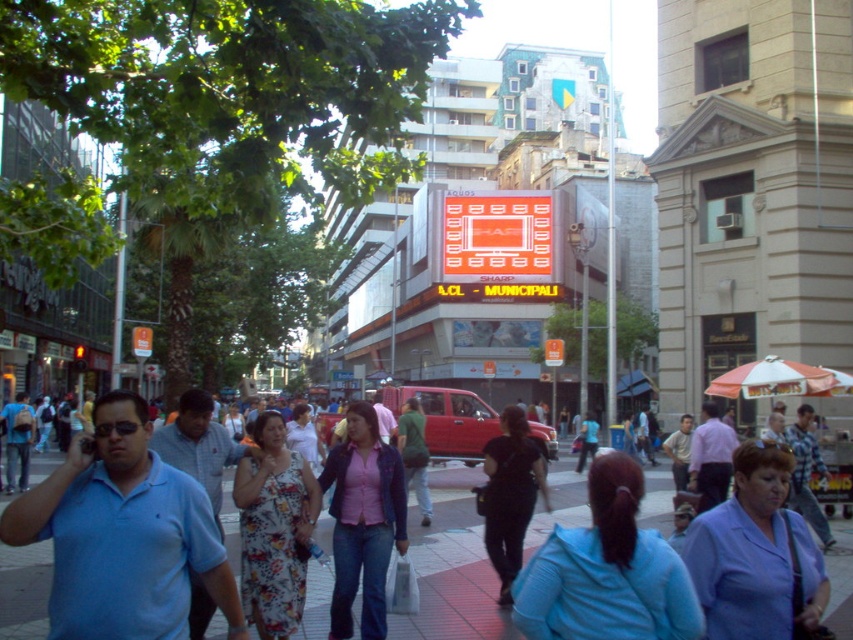
Question: Which of the following is the farthest from the observer?

Choices:
 (A) (86, 524)
 (B) (474, 570)

Answer: (B)

Question: Which point is closer to the camera?

Choices:
 (A) (444, 625)
 (B) (227, 628)

Answer: (B)

Question: From the image, what is the correct spatial relationship of blue cotton polo shirt at left in relation to smooth concrete sidewalk at center?

Choices:
 (A) below
 (B) above

Answer: (B)

Question: Can you confirm if blue cotton polo shirt at left is wider than smooth concrete sidewalk at center?

Choices:
 (A) yes
 (B) no

Answer: (B)

Question: Among these points, which one is nearest to the camera?

Choices:
 (A) (425, 556)
 (B) (120, 444)

Answer: (B)

Question: Is blue cotton polo shirt at left to the right of smooth concrete sidewalk at center from the viewer's perspective?

Choices:
 (A) yes
 (B) no

Answer: (B)